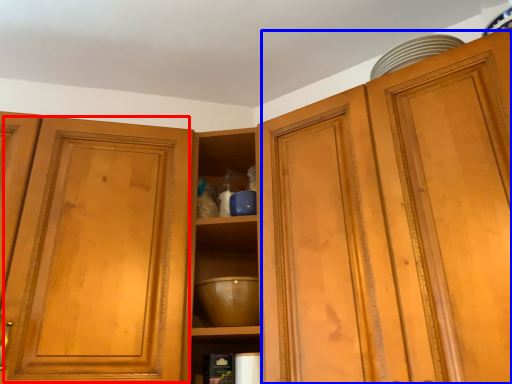
Question: Which point is closer to the camera, glass door (highlighted by a red box) or cabinetry (highlighted by a blue box)?

Choices:
 (A) glass door
 (B) cabinetry

Answer: (B)